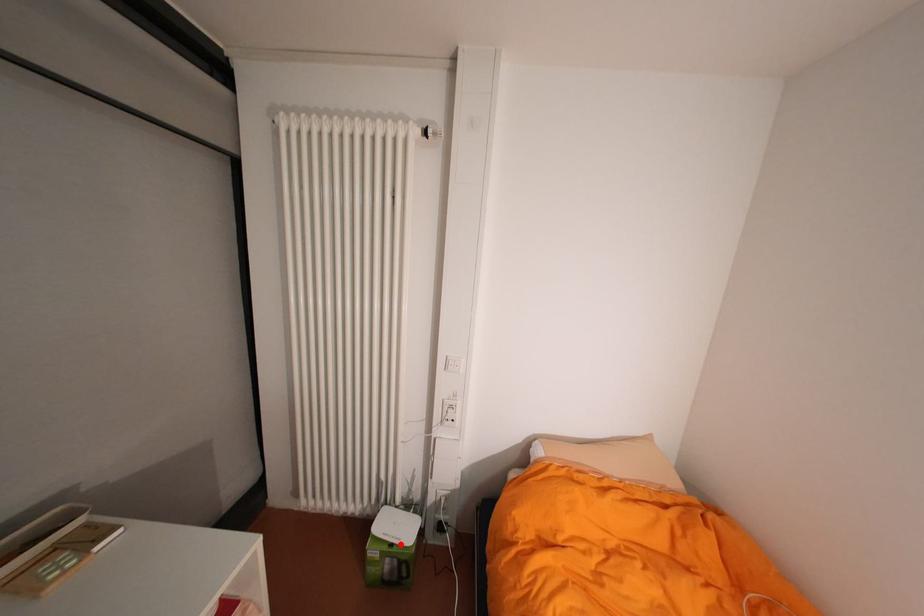
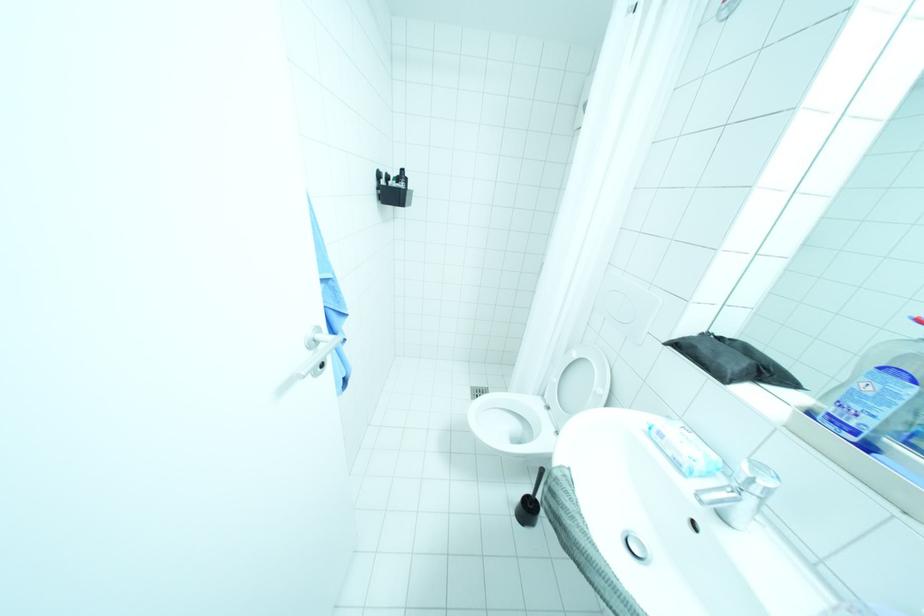
Question: I am providing you with two images of the same scene from different viewpoints. A red point is marked on the first image. Can you still see the location of the red point in image 2?

Choices:
 (A) Yes
 (B) No

Answer: (B)